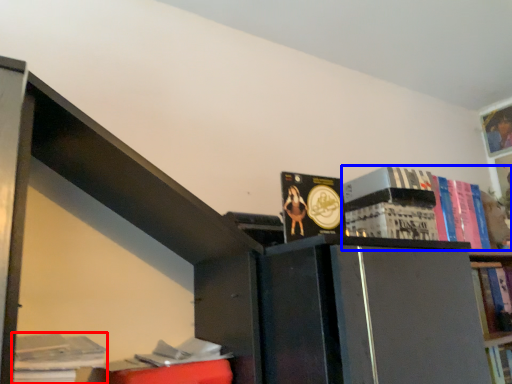
Question: Which point is closer to the camera, book (highlighted by a red box) or book (highlighted by a blue box)?

Choices:
 (A) book
 (B) book

Answer: (A)